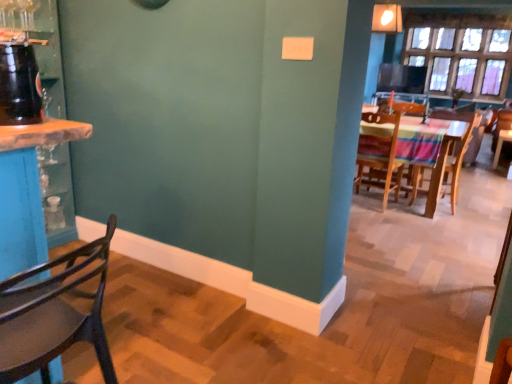
Question: From the image's perspective, is wooden chair at center, the third chair positioned from the left, under wooden chair at left, which appears as the 1th chair when viewed from the front?

Choices:
 (A) yes
 (B) no

Answer: (B)

Question: Considering the relative positions of wooden chair at center, the third chair when ordered from front to back, and wooden chair at left, which is the fourth chair from back to front, in the image provided, is wooden chair at center, the third chair when ordered from front to back, behind wooden chair at left, which is the fourth chair from back to front,?

Choices:
 (A) no
 (B) yes

Answer: (B)

Question: Is wooden chair at center, which is counted as the second chair, starting from the right, surrounding wooden chair at left, which appears as the 1th chair when viewed from the front?

Choices:
 (A) yes
 (B) no

Answer: (B)

Question: From a real-world perspective, is wooden chair at center, the third chair positioned from the left, positioned under wooden chair at left, arranged as the 4th chair when viewed from the right, based on gravity?

Choices:
 (A) no
 (B) yes

Answer: (B)

Question: Would you say wooden chair at center, which is counted as the second chair, starting from the right, is outside wooden chair at left, which is the first chair from left to right?

Choices:
 (A) yes
 (B) no

Answer: (A)

Question: Is wooden chair at right, the first chair positioned from the back, bigger or smaller than wooden chair at left, arranged as the 4th chair when viewed from the right?

Choices:
 (A) small
 (B) big

Answer: (A)

Question: Looking at their shapes, would you say wooden chair at right, marked as the 4th chair in a left-to-right arrangement, is wider or thinner than wooden chair at left, which appears as the 1th chair when viewed from the front?

Choices:
 (A) thin
 (B) wide

Answer: (A)

Question: From a real-world perspective, is wooden chair at right, marked as the 4th chair in a front-to-back arrangement, above or below wooden chair at left, which is the first chair from left to right?

Choices:
 (A) below
 (B) above

Answer: (A)

Question: Considering their positions, is wooden chair at right, the first chair positioned from the right, located in front of or behind wooden chair at left, arranged as the 4th chair when viewed from the right?

Choices:
 (A) behind
 (B) front

Answer: (A)

Question: Would you say wooden chair at right, positioned as the 2th chair in front-to-back order, is inside or outside wooden chair at right, the first chair positioned from the back?

Choices:
 (A) outside
 (B) inside

Answer: (A)

Question: From the image's perspective, relative to wooden chair at right, marked as the 4th chair in a front-to-back arrangement, is wooden chair at right, which is the second chair in left-to-right order, above or below?

Choices:
 (A) below
 (B) above

Answer: (A)

Question: Looking at the image, does wooden chair at right, which ranks as the 3th chair in back-to-front order, seem bigger or smaller compared to wooden chair at right, the first chair positioned from the back?

Choices:
 (A) small
 (B) big

Answer: (B)

Question: Considering their positions, is wooden chair at right, which is the second chair in left-to-right order, located in front of or behind wooden chair at right, marked as the 4th chair in a front-to-back arrangement?

Choices:
 (A) behind
 (B) front

Answer: (B)

Question: Would you say wooden chair at right, positioned as the 2th chair in front-to-back order, is inside or outside clear glass window at upper right?

Choices:
 (A) inside
 (B) outside

Answer: (B)

Question: Relative to clear glass window at upper right, is wooden chair at right, which is the third chair from right to left, in front or behind?

Choices:
 (A) behind
 (B) front

Answer: (B)